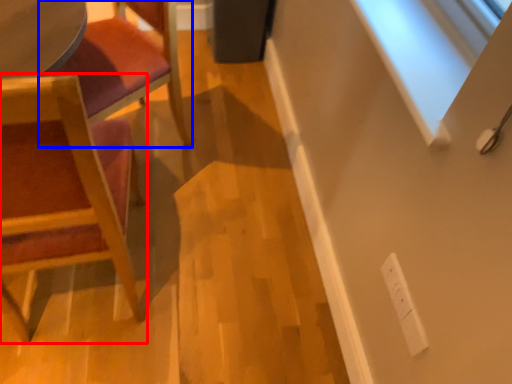
Question: Which object appears closest to the camera in this image, chair (highlighted by a red box) or chair (highlighted by a blue box)?

Choices:
 (A) chair
 (B) chair

Answer: (A)